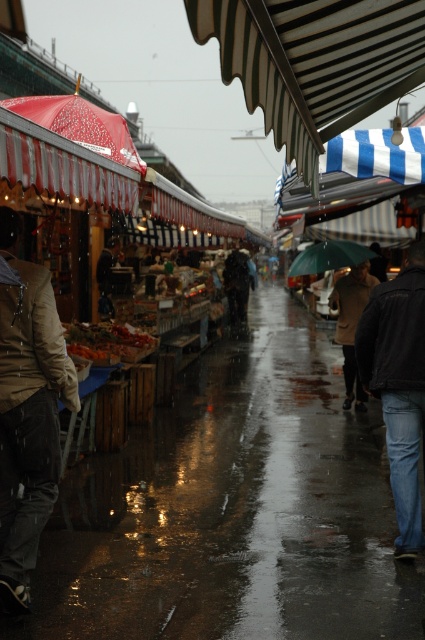
You are standing at the entrance of the market and see two points marked in the image. The first point is at coordinates point (0, 209) and the second is at point (354, 365). Which point is closer to you?

Point (0, 209) is in front of point (354, 365), so the first point is closer to you.

You are a customer at the market and want to pick up the tan leather jacket at left and the brown wool coat at center. Which item should you reach for first if you want to grab the lower one?

The tan leather jacket at left is below the brown wool coat at center, so you should reach for the tan leather jacket at left first.

You are a customer at the market and want to buy a jacket that reaches down to your knees. The tan leather jacket at left and the brown wool coat at center are both available. Which one should you choose?

The tan leather jacket at left has a greater height compared to the brown wool coat at center, so you should choose the tan leather jacket at left as it reaches down to your knees.